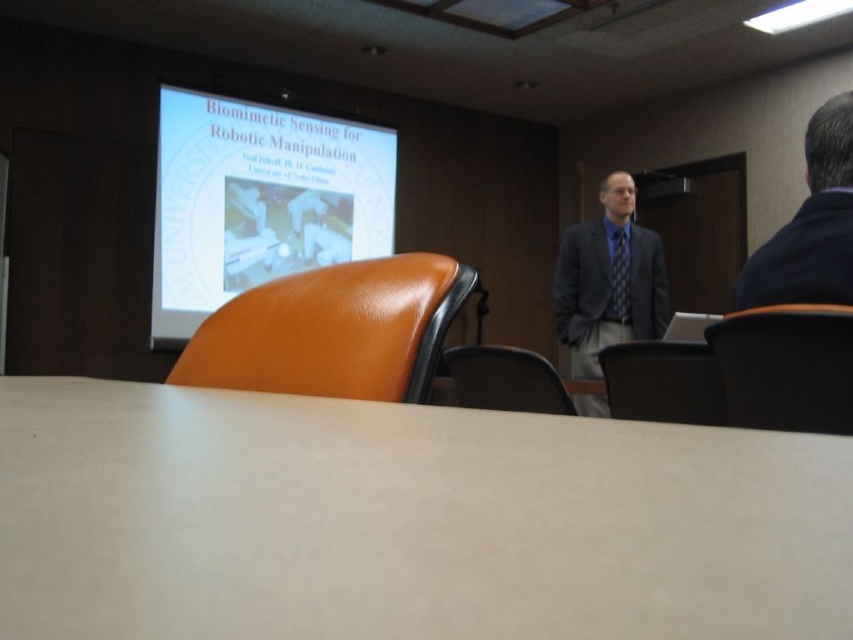
Question: Does leather at center have a lesser width compared to dark blue shirt at upper right?

Choices:
 (A) yes
 (B) no

Answer: (B)

Question: Among these points, which one is nearest to the camera?

Choices:
 (A) (752, 310)
 (B) (235, 273)
 (C) (612, 308)

Answer: (A)

Question: Which of the following is the farthest from the observer?

Choices:
 (A) white matte table at center
 (B) leather at center
 (C) white glossy projection screen at upper center
 (D) black leather chair at lower center

Answer: (C)

Question: Can you confirm if white glossy projection screen at upper center is positioned to the right of dark blue shirt at upper right?

Choices:
 (A) no
 (B) yes

Answer: (A)

Question: Does leather-like orange chair at center have a greater width compared to leather chair at center?

Choices:
 (A) yes
 (B) no

Answer: (B)

Question: Which of the following is the closest to the observer?

Choices:
 (A) white matte table at center
 (B) black leather chair at lower center
 (C) white glossy projection screen at upper center

Answer: (A)